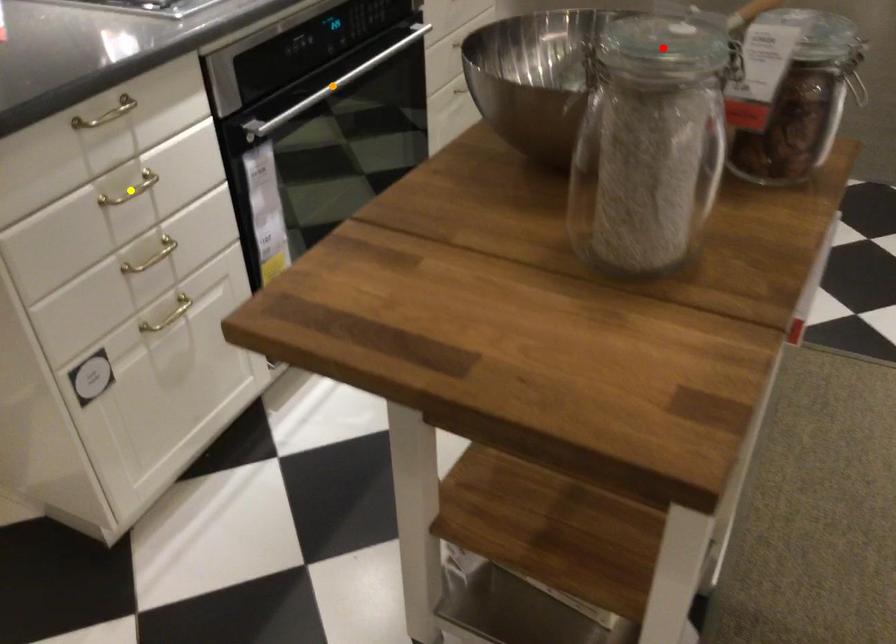
Order these from nearest to farthest:
red point, yellow point, orange point

red point, yellow point, orange point